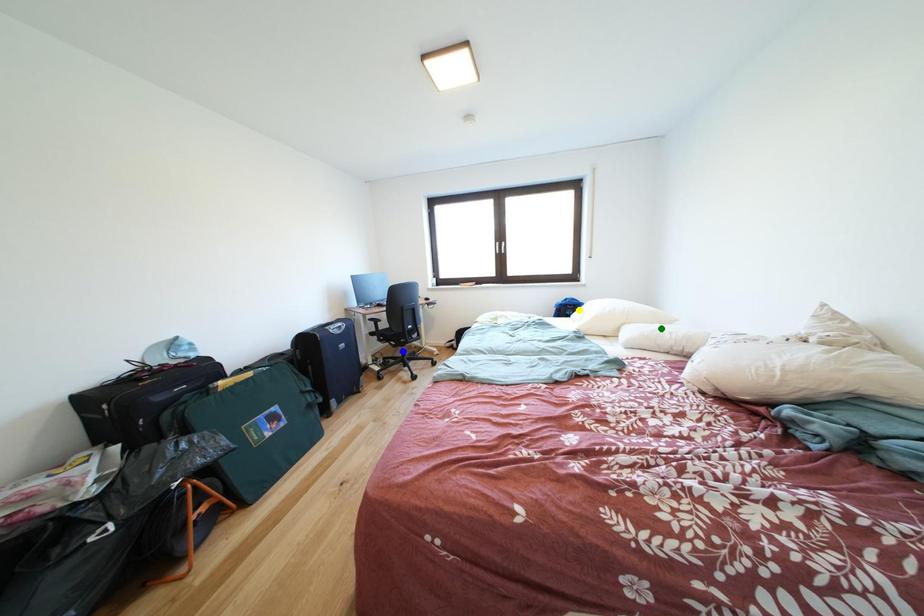
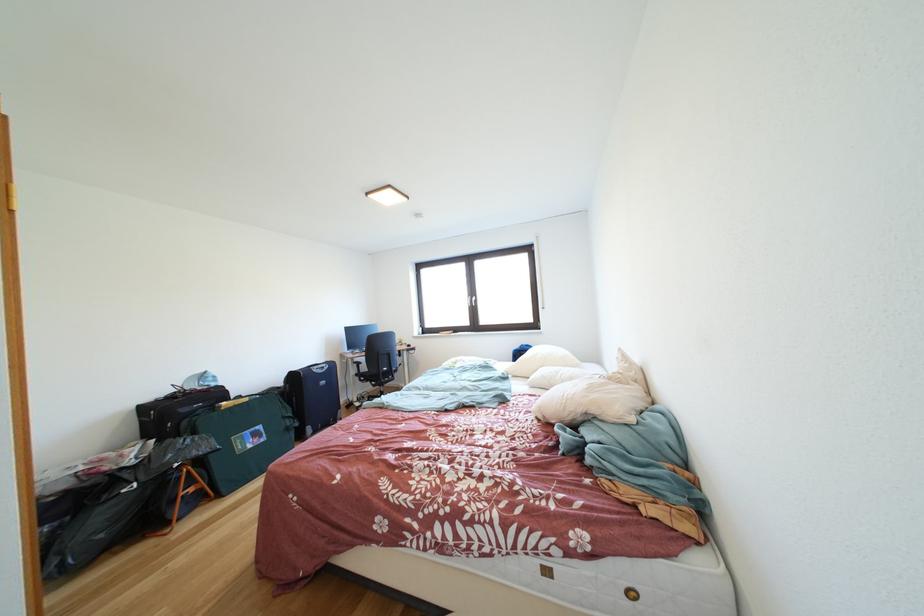
I am providing you with two images of the same scene from different viewpoints. Three points are marked in image1. Which point corresponds to a part or object that is occluded in image2?In image1, three points are marked. Which of them correspond to a part or object that is occluded in image2?Among the three points shown in image1, which one corresponds to a part or object that is no longer visible due to occlusion in image2?

Invisible in image2: yellow point.